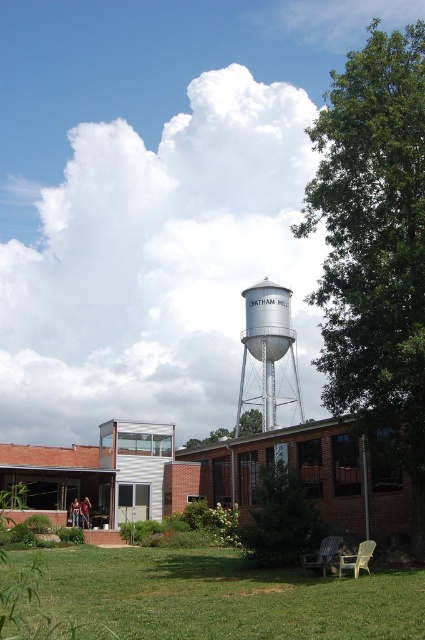
You are standing in the outdoor scene and want to determine the relative positions of two points. Which point is closer to you, point (x=90, y=609) or point (x=260, y=291)?

Point (x=90, y=609) is closer to the viewer than point (x=260, y=291).

Consider the image. You are standing at the center of the image and want to walk towards the green grass at lower center. What direction should you move in?

Since the green grass at lower center is located at point 0.934 on the x and 0.525 on the y, you should move towards the lower center direction to reach it.

You are standing in the middle of the green grass at lower center and want to reach the silver metallic water tower at center. Which direction should you move to get closer to the water tower?

Since the green grass at lower center occupies less space than the silver metallic water tower at center, you should move forward towards the center of the image to get closer to the water tower.